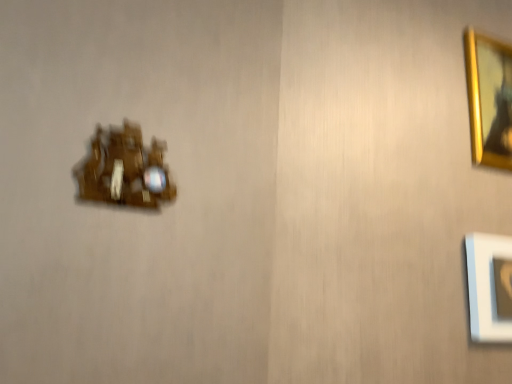
Identify the location of wooden clock at left. This screenshot has width=512, height=384. (124, 170).

The image size is (512, 384). Describe the element at coordinates (124, 170) in the screenshot. I see `wooden clock at left` at that location.

Where is `gold metallic picture frame at upper right`? gold metallic picture frame at upper right is located at coordinates (489, 99).

This screenshot has width=512, height=384. Describe the element at coordinates (489, 99) in the screenshot. I see `gold metallic picture frame at upper right` at that location.

Locate an element on the screen. This screenshot has width=512, height=384. wooden clock at left is located at coordinates click(124, 170).

Based on their positions, is gold metallic picture frame at upper right located to the left or right of wooden clock at left?

From the image, it's evident that gold metallic picture frame at upper right is to the right of wooden clock at left.

Is the depth of gold metallic picture frame at upper right greater than that of wooden clock at left?

Yes, gold metallic picture frame at upper right is further from the camera.

Is point (475, 135) closer to camera compared to point (91, 163)?

No, it is behind (91, 163).

Consider the image. From the image's perspective, is gold metallic picture frame at upper right located above or below wooden clock at left?

gold metallic picture frame at upper right is situated higher than wooden clock at left in the image.

From a real-world perspective, is gold metallic picture frame at upper right over wooden clock at left?

Yes.

Which object is wider, gold metallic picture frame at upper right or wooden clock at left?

Wider between the two is gold metallic picture frame at upper right.

Considering the relative sizes of gold metallic picture frame at upper right and wooden clock at left in the image provided, is gold metallic picture frame at upper right shorter than wooden clock at left?

In fact, gold metallic picture frame at upper right may be taller than wooden clock at left.

Considering the sizes of gold metallic picture frame at upper right and wooden clock at left in the image, is gold metallic picture frame at upper right bigger or smaller than wooden clock at left?

gold metallic picture frame at upper right is bigger than wooden clock at left.

Based on the photo, is gold metallic picture frame at upper right located outside wooden clock at left?

gold metallic picture frame at upper right lies outside wooden clock at left's area.

Is gold metallic picture frame at upper right directly adjacent to wooden clock at left?

No, gold metallic picture frame at upper right is not touching wooden clock at left.

Is gold metallic picture frame at upper right facing towards wooden clock at left?

No, gold metallic picture frame at upper right is not aimed at wooden clock at left.

Identify the location of portrait below the gold metallic picture frame at upper right (from the image's perspective). (124, 170).

Based on their positions, is wooden clock at left located to the left or right of gold metallic picture frame at upper right?

Clearly, wooden clock at left is on the left of gold metallic picture frame at upper right in the image.

Is the depth of wooden clock at left less than that of gold metallic picture frame at upper right?

Yes, wooden clock at left is in front of gold metallic picture frame at upper right.

Which point is more distant from viewer, (149, 202) or (490, 138)?

Point (490, 138)

Looking at this image, from the image's perspective, is wooden clock at left beneath gold metallic picture frame at upper right?

Yes.

From a real-world perspective, is wooden clock at left positioned over gold metallic picture frame at upper right based on gravity?

No, from a real-world perspective, wooden clock at left is not above gold metallic picture frame at upper right.

From the picture: Which object is wider, wooden clock at left or gold metallic picture frame at upper right?

Wider between the two is gold metallic picture frame at upper right.

Based on the photo, who is shorter, wooden clock at left or gold metallic picture frame at upper right?

With less height is wooden clock at left.

From the picture: Considering the relative sizes of wooden clock at left and gold metallic picture frame at upper right in the image provided, is wooden clock at left smaller than gold metallic picture frame at upper right?

Indeed, wooden clock at left has a smaller size compared to gold metallic picture frame at upper right.

Is wooden clock at left completely or partially outside of gold metallic picture frame at upper right?

wooden clock at left is positioned outside gold metallic picture frame at upper right.

Is wooden clock at left not close to gold metallic picture frame at upper right?

Actually, wooden clock at left and gold metallic picture frame at upper right are a little close together.

Is wooden clock at left oriented towards gold metallic picture frame at upper right?

No, wooden clock at left is not aimed at gold metallic picture frame at upper right.

How different are the orientations of wooden clock at left and gold metallic picture frame at upper right in degrees?

They differ by 0.000483 degrees in their facing directions.

How far apart are wooden clock at left and gold metallic picture frame at upper right?

wooden clock at left and gold metallic picture frame at upper right are 30.46 inches apart from each other.

What are the coordinates of `picture frame above the wooden clock at left (from the image's perspective)` in the screenshot? It's located at (489, 99).

Where is `portrait lying below the gold metallic picture frame at upper right (from the image's perspective)`? portrait lying below the gold metallic picture frame at upper right (from the image's perspective) is located at coordinates (124, 170).

This screenshot has height=384, width=512. Identify the location of picture frame above the wooden clock at left (from a real-world perspective). (489, 99).